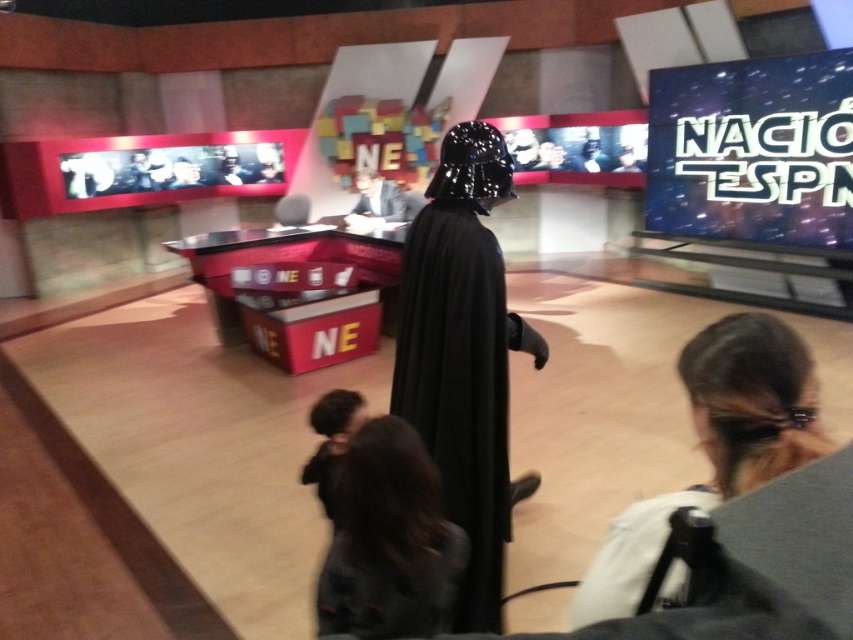
You are a costume designer observing the TV studio set. You need to determine the spatial relationship between the black matte cape at center and the dark brown hair at lower right. Which object is positioned higher in the image?

The dark brown hair at lower right is positioned higher than the black matte cape at center because the cape is located below the hair.

Looking at this image, you are a camera operator in the studio. You need to focus on the dark brown hair at lower right and the black matte robe at center. Which object should you adjust your camera to the right to capture better?

The dark brown hair at lower right is to the right of the black matte robe at center, so you should adjust your camera to the right to better capture the dark brown hair at lower right.